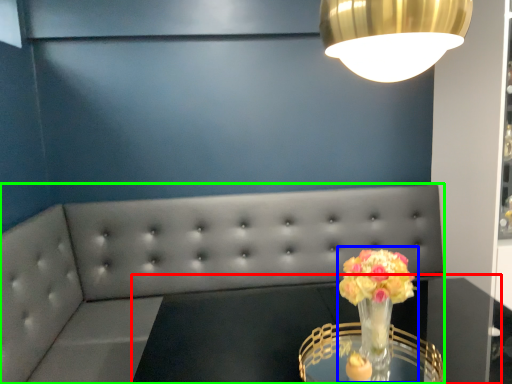
Question: Estimate the real-world distances between objects in this image. Which object is closer to round table (highlighted by a red box), floral arrangement (highlighted by a blue box) or studio couch (highlighted by a green box)?

Choices:
 (A) floral arrangement
 (B) studio couch

Answer: (A)